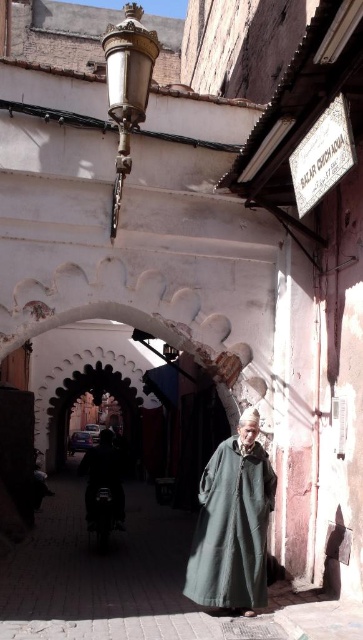
Does dark green fabric at center lie in front of dark blue fabric at center?

Yes, it is in front of dark blue fabric at center.

Describe the element at coordinates (231, 529) in the screenshot. I see `dark green fabric at center` at that location.

Where is `dark green fabric at center`? This screenshot has width=363, height=640. dark green fabric at center is located at coordinates (231, 529).